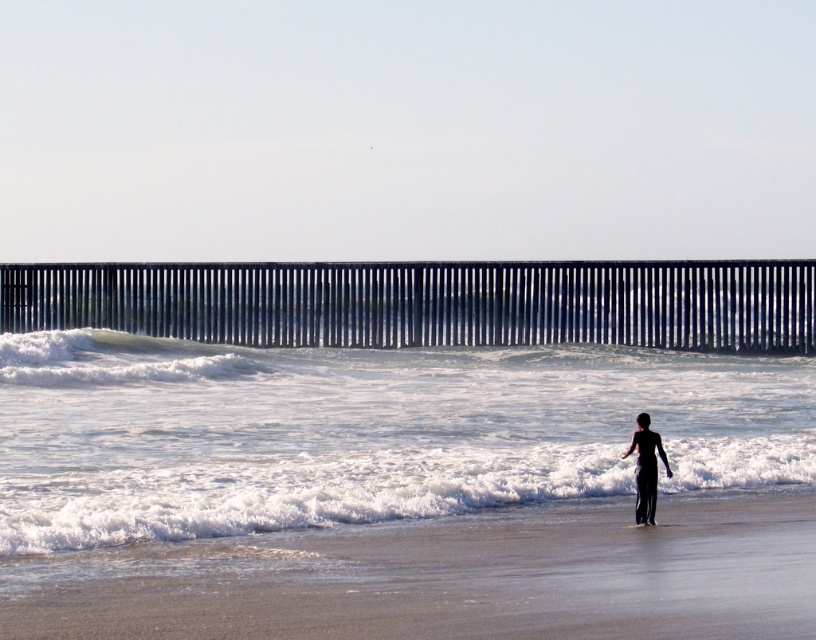
You are a photographer trying to capture a shot of the white foamy wave at center and the white foam surfboard at lower center. Which object is closer to the camera?

The white foam surfboard at lower center is closer to the camera because the white foamy wave at center is further away from the viewer.

You are a photographer trying to capture the white frothy water at center and the white foamy wave at center in a single shot. Based on their positions, which one is closer to the camera?

The white frothy water at center is closer to the camera because it is positioned in front of the white foamy wave at center.